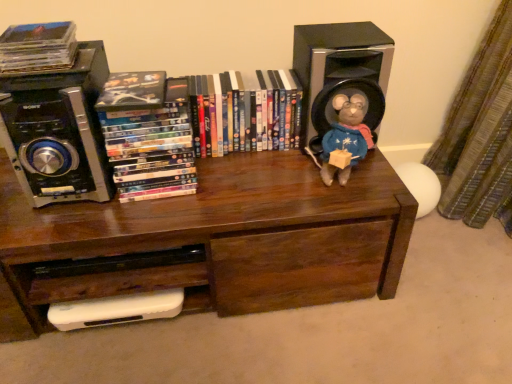
Question: Is black plastic speaker at upper left, which ranks as the 2th speaker in right-to-left order, far from brown wood bookcase at center?

Choices:
 (A) no
 (B) yes

Answer: (A)

Question: Does black plastic speaker at upper left, arranged as the first speaker when viewed from the left, come in front of brown wood bookcase at center?

Choices:
 (A) yes
 (B) no

Answer: (A)

Question: Is black plastic speaker at upper left, arranged as the first speaker when viewed from the left, turned away from brown wood bookcase at center?

Choices:
 (A) yes
 (B) no

Answer: (B)

Question: Can you confirm if black plastic speaker at upper left, which ranks as the 2th speaker in right-to-left order, is wider than brown wood bookcase at center?

Choices:
 (A) yes
 (B) no

Answer: (B)

Question: Does black plastic speaker at upper left, which ranks as the 2th speaker in right-to-left order, lie behind brown wood bookcase at center?

Choices:
 (A) no
 (B) yes

Answer: (A)

Question: Can you see black plastic speaker at upper left, which ranks as the 2th speaker in right-to-left order, touching brown wood bookcase at center?

Choices:
 (A) yes
 (B) no

Answer: (B)

Question: Does matte plastic dvds at center, marked as the first book in a right-to-left arrangement, have a greater width compared to fuzzy fabric stuffed animal at upper right?

Choices:
 (A) no
 (B) yes

Answer: (B)

Question: From the image's perspective, is matte plastic dvds at center, marked as the first book in a right-to-left arrangement, located beneath fuzzy fabric stuffed animal at upper right?

Choices:
 (A) yes
 (B) no

Answer: (B)

Question: From a real-world perspective, is matte plastic dvds at center, marked as the first book in a right-to-left arrangement, beneath fuzzy fabric stuffed animal at upper right?

Choices:
 (A) yes
 (B) no

Answer: (A)

Question: Is matte plastic dvds at center, which ranks as the 3th book in left-to-right order, further to the viewer compared to fuzzy fabric stuffed animal at upper right?

Choices:
 (A) no
 (B) yes

Answer: (B)

Question: Is matte plastic dvds at center, which ranks as the 3th book in left-to-right order, positioned before fuzzy fabric stuffed animal at upper right?

Choices:
 (A) no
 (B) yes

Answer: (A)

Question: Does matte plastic dvds at center, which ranks as the 3th book in left-to-right order, touch fuzzy fabric stuffed animal at upper right?

Choices:
 (A) yes
 (B) no

Answer: (B)

Question: Is black plastic speaker at upper left, arranged as the first speaker when viewed from the left, not near fuzzy fabric stuffed animal at upper right?

Choices:
 (A) yes
 (B) no

Answer: (B)